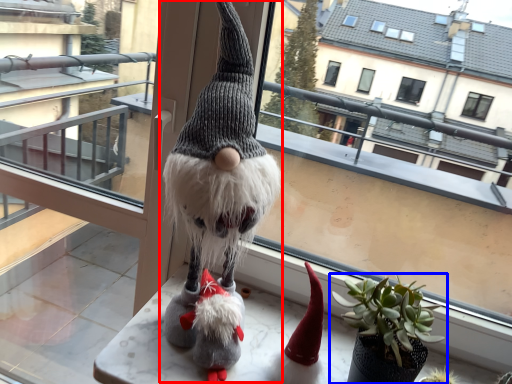
Question: Which point is closer to the camera, figurine (highlighted by a red box) or houseplant (highlighted by a blue box)?

Choices:
 (A) figurine
 (B) houseplant

Answer: (A)